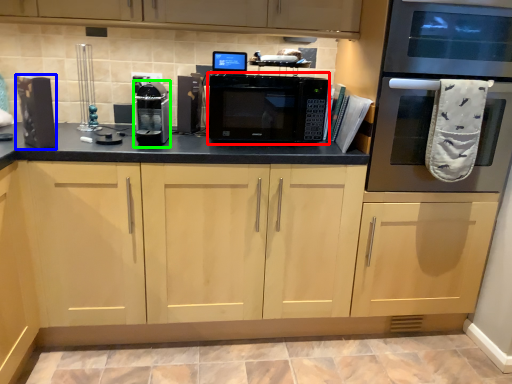
Question: Which is nearer to the microwave oven (highlighted by a red box)? appliance (highlighted by a blue box) or appliance (highlighted by a green box).

Choices:
 (A) appliance
 (B) appliance

Answer: (B)